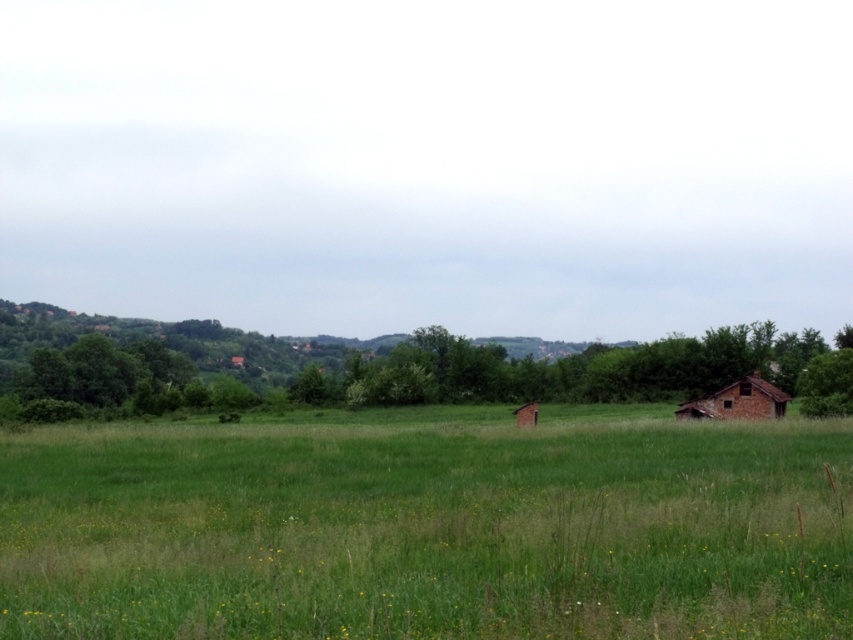
You are a farmer who needs to move a heavy tractor from the green grassy pasture at center to the brown rustic hut at lower right. The tractor requires a minimum of 80 feet of space to maneuver safely. Based on the scene, can you safely move the tractor without any obstacles?

The green grassy pasture at center and brown rustic hut at lower right are 86.80 feet apart from each other. Since the tractor requires a minimum of 80 feet of space to maneuver safely, the distance between them is sufficient. Therefore, you can safely move the tractor without any obstacles.